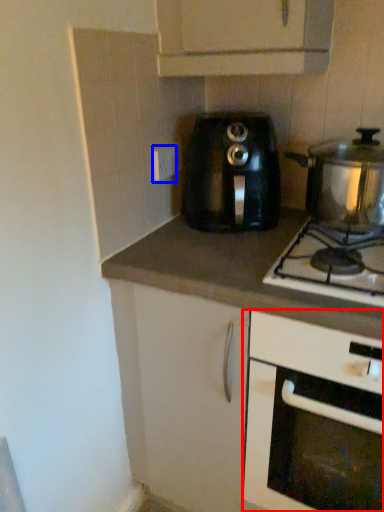
Question: Which object is closer to the camera taking this photo, cabinetry (highlighted by a red box) or electric outlet (highlighted by a blue box)?

Choices:
 (A) cabinetry
 (B) electric outlet

Answer: (A)